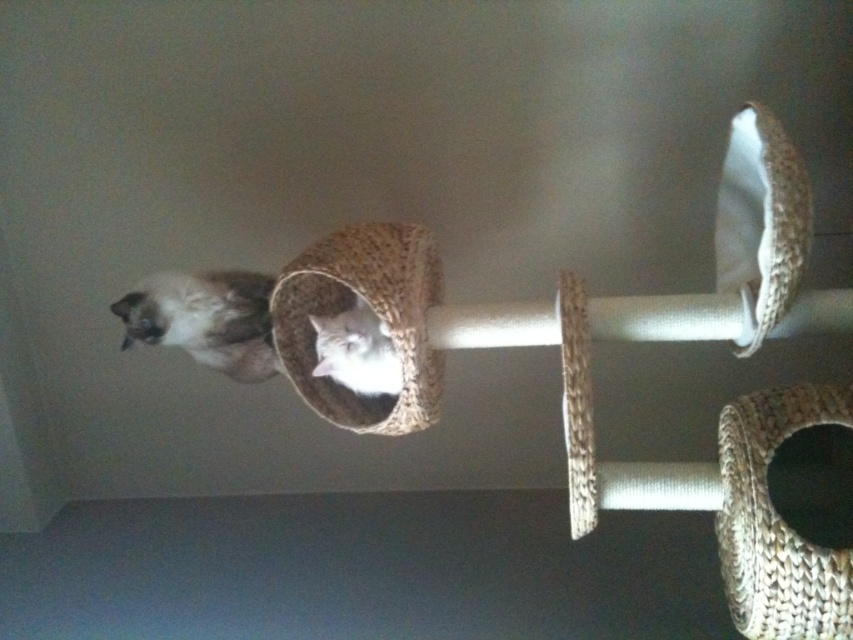
Who is more distant from viewer, (410, 410) or (370, 314)?

The point (370, 314) is behind.

Measure the distance between natural woven cat bed at center and white soft cat at center.

They are 2.59 inches apart.

Which is behind, point (396, 298) or point (378, 360)?

The point (378, 360) is more distant.

What are the coordinates of `natural woven cat bed at center` in the screenshot? It's located at (373, 308).

Can you confirm if natural woven cat bed at center is positioned above silky white cat at upper left?

Actually, natural woven cat bed at center is below silky white cat at upper left.

Does natural woven cat bed at center appear under silky white cat at upper left?

Indeed, natural woven cat bed at center is positioned under silky white cat at upper left.

Does point (302, 348) come in front of point (186, 317)?

No.

Locate an element on the screen. The image size is (853, 640). natural woven cat bed at center is located at coordinates (373, 308).

Can you confirm if silky white cat at upper left is taller than white soft cat at center?

Yes, silky white cat at upper left is taller than white soft cat at center.

Is point (126, 305) positioned before point (392, 388)?

That is True.

Is point (193, 308) farther from camera compared to point (334, 317)?

No, it is not.

At what (x,y) coordinates should I click in order to perform the action: click on silky white cat at upper left. Please return your answer as a coordinate pair (x, y). The width and height of the screenshot is (853, 640). Looking at the image, I should click on (206, 320).